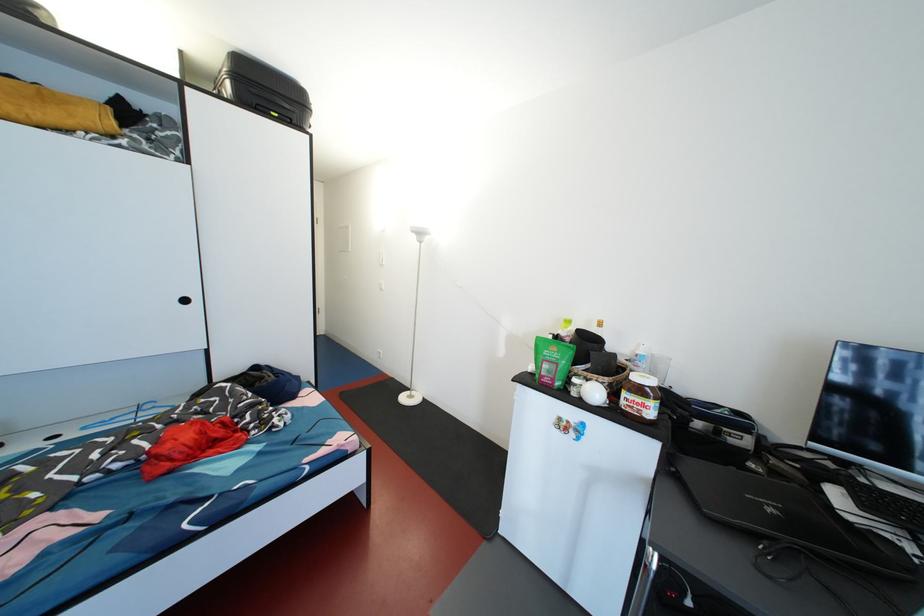
You are a GUI agent. You are given a task and a screenshot of the screen. Output one action in this format:
    pyautogui.click(x=<x>, y=<y>)
    Task: Click on the black door handle
    
    Given the screenshot: What is the action you would take?
    pyautogui.click(x=185, y=300)